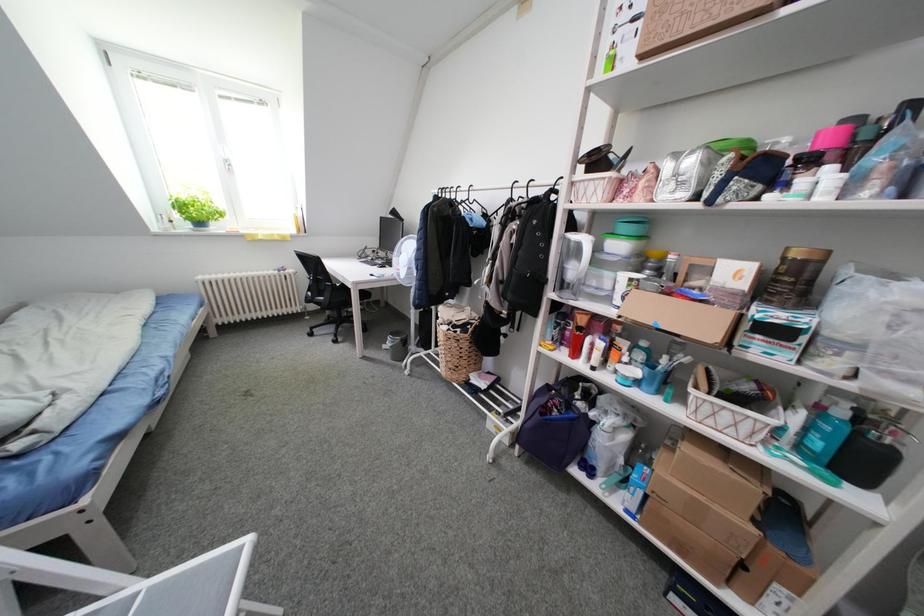
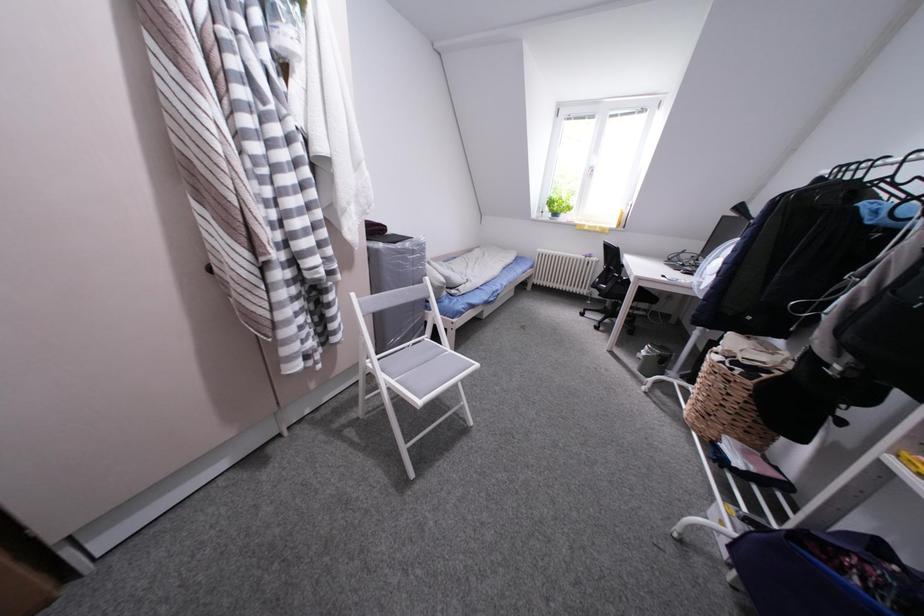
Question: Based on the continuous images, in which direction is the camera rotating? Reply with the corresponding letter.

Choices:
 (A) Left
 (B) Right
 (C) Up
 (D) Down

Answer: (A)